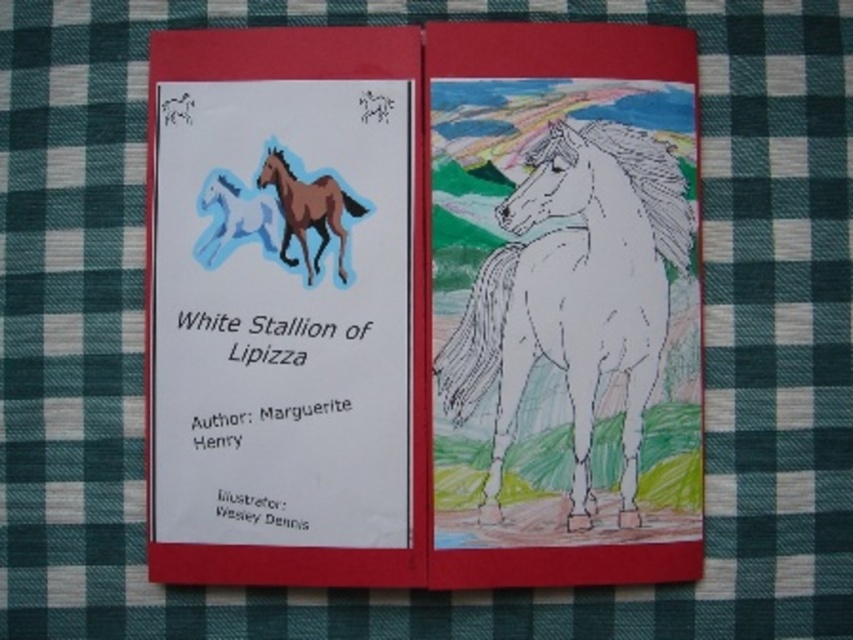
Question: Estimate the real-world distances between objects in this image. Which object is farther from the white paper horse at center?

Choices:
 (A) brown glossy horse at upper left
 (B) blue paper horse at upper left

Answer: (B)

Question: Is white paper horse at center below blue paper horse at upper left?

Choices:
 (A) yes
 (B) no

Answer: (A)

Question: Is white paper horse at center wider than brown glossy horse at upper left?

Choices:
 (A) yes
 (B) no

Answer: (A)

Question: Which object is positioned closest to the blue paper horse at upper left?

Choices:
 (A) white paper horse at center
 (B) brown glossy horse at upper left

Answer: (B)

Question: Which point appears closest to the camera in this image?

Choices:
 (A) coord(525,259)
 (B) coord(329,221)
 (C) coord(257,216)

Answer: (A)

Question: Is white paper horse at center above blue paper horse at upper left?

Choices:
 (A) yes
 (B) no

Answer: (B)